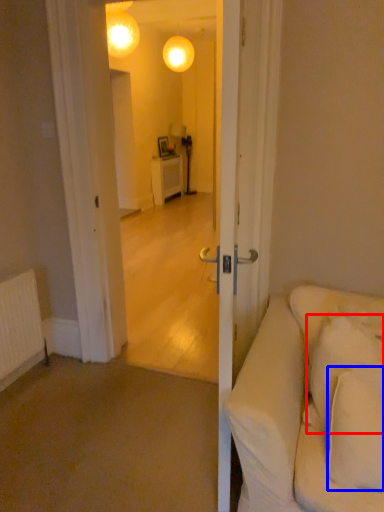
Question: Among these objects, which one is farthest to the camera, pillow (highlighted by a red box) or pillow (highlighted by a blue box)?

Choices:
 (A) pillow
 (B) pillow

Answer: (A)